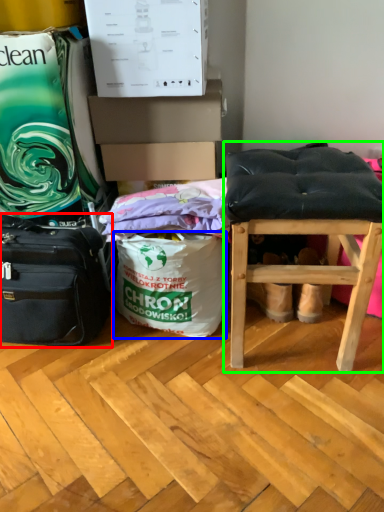
Question: Which is nearer to the luggage and bags (highlighted by a red box)? shopping bag (highlighted by a blue box) or stool (highlighted by a green box).

Choices:
 (A) shopping bag
 (B) stool

Answer: (A)